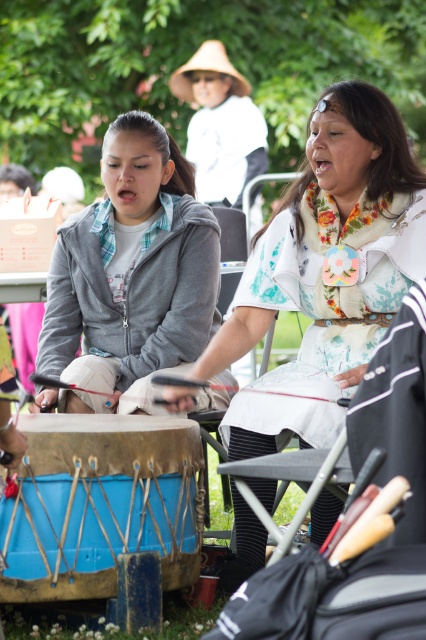
Who is lower down, gray fleece jacket at center or blue leather drum at lower left?

blue leather drum at lower left is below.

Can you confirm if gray fleece jacket at center is shorter than blue leather drum at lower left?

Incorrect, gray fleece jacket at center's height does not fall short of blue leather drum at lower left's.

You are a GUI agent. You are given a task and a screenshot of the screen. Output one action in this format:
    pyautogui.click(x=<x>, y=<y>)
    Task: Click on the gray fleece jacket at center
    Image resolution: width=426 pixels, height=640 pixels.
    Given the screenshot: What is the action you would take?
    pyautogui.click(x=131, y=273)

Image resolution: width=426 pixels, height=640 pixels. What are the coordinates of `gray fleece jacket at center` in the screenshot? It's located at (131, 273).

Is point (334, 170) positioned in front of point (54, 346)?

That is True.

In the scene shown: Is matte white dress at center to the right of gray fleece jacket at center from the viewer's perspective?

Indeed, matte white dress at center is positioned on the right side of gray fleece jacket at center.

Measure the distance between point (357, 93) and camera.

4.54 meters

The width and height of the screenshot is (426, 640). What are the coordinates of `matte white dress at center` in the screenshot? It's located at (333, 246).

From the picture: Between matte white dress at center and blue leather drum at lower left, which one appears on the left side from the viewer's perspective?

blue leather drum at lower left

Where is `matte white dress at center`? matte white dress at center is located at coordinates click(333, 246).

Where is `matte white dress at center`? The width and height of the screenshot is (426, 640). matte white dress at center is located at coordinates (333, 246).